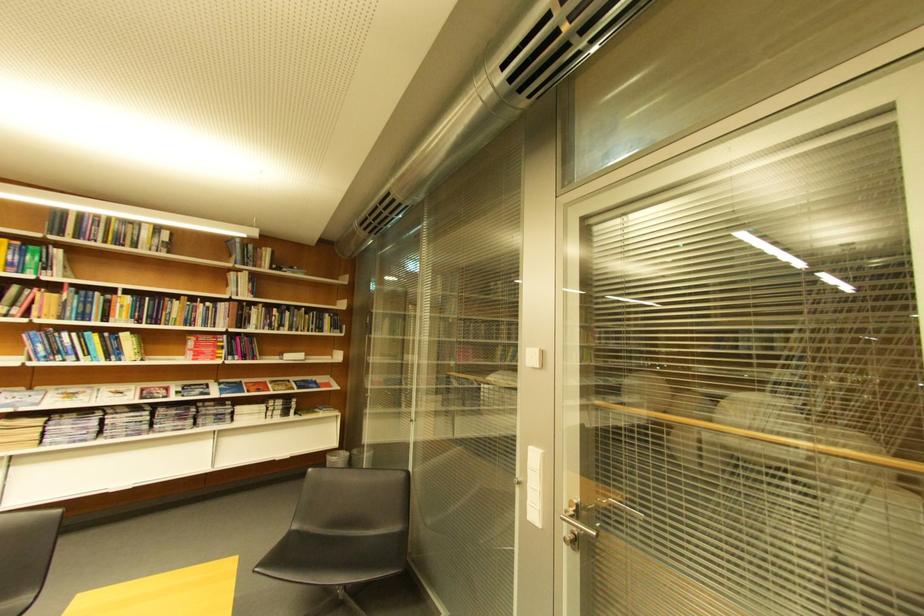
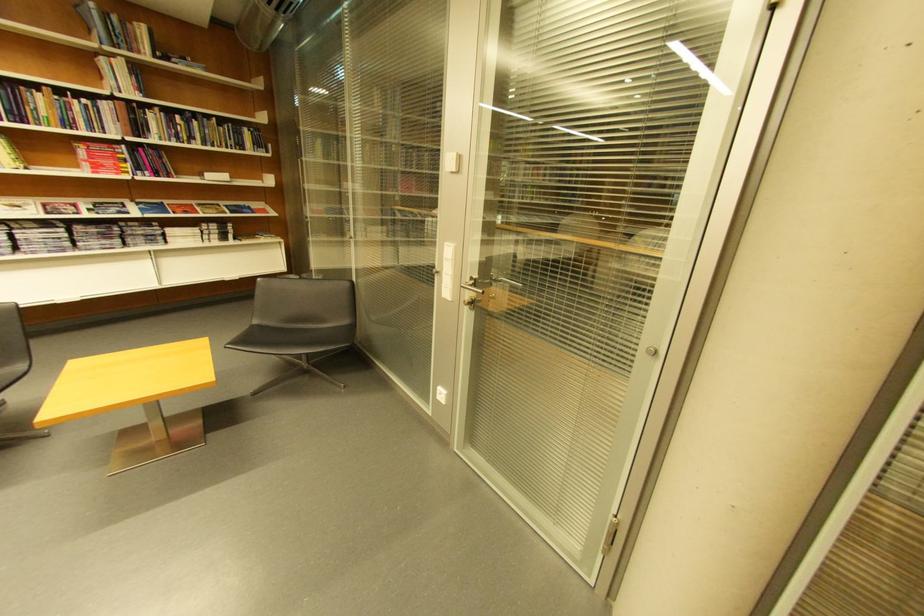
Find the pixel in the second image that matches point 242,276 in the first image.

(113, 62)